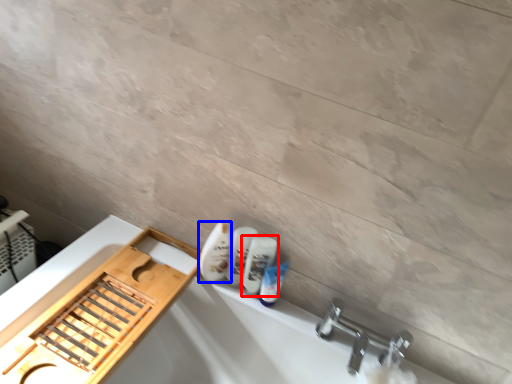
Question: Which point is further to the camera, mouthwash (highlighted by a red box) or toiletry (highlighted by a blue box)?

Choices:
 (A) mouthwash
 (B) toiletry

Answer: (A)